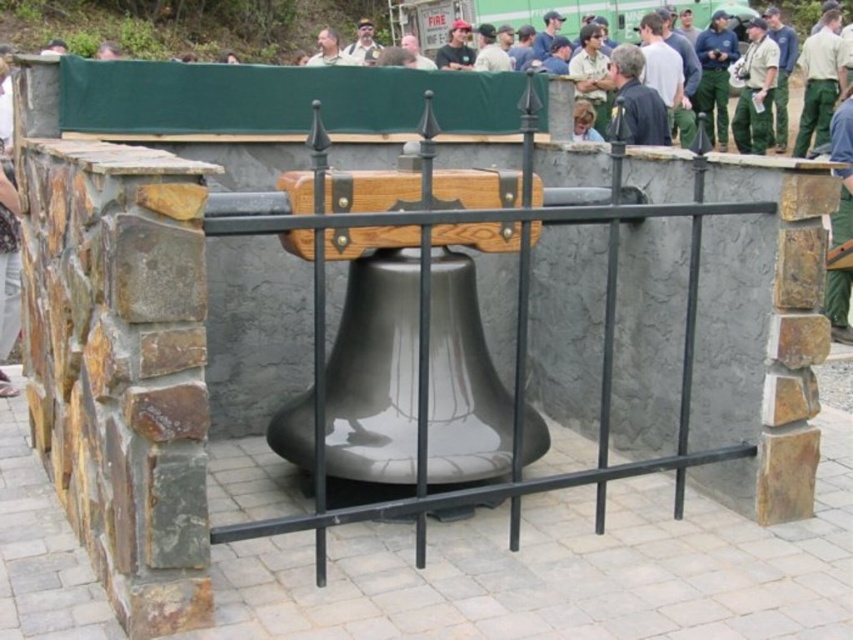
You are an observer standing in front of the bell and notice two items at the upper right corner of the image. The items are labeled as green uniform pants at upper right and green uniform at upper right. Which of these two items is taller?

The green uniform pants at upper right is much taller than the green uniform at upper right according to the description.

You are standing in front of the bell and notice two items nearby. The green uniform at upper right and the light brown leather jacket at center. Which item is positioned more to the right side of the scene?

The green uniform at upper right is positioned more to the right side of the scene compared to the light brown leather jacket at center.

You are standing in front of the bell and notice two green items at the upper right corner of the image. Which one is closer to you, the green uniform pants at upper right or the green uniform at upper right?

The green uniform pants at upper right is in front of the green uniform at upper right, so it is closer to you.